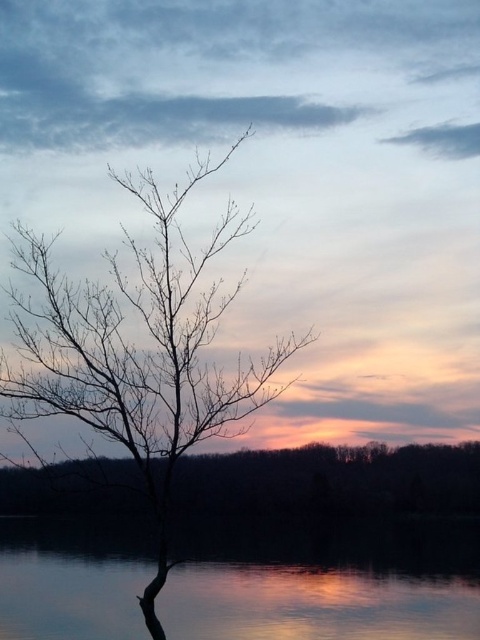
Question: Which point is farther to the camera?

Choices:
 (A) (121, 365)
 (B) (430, 593)

Answer: (B)

Question: Can you confirm if smooth water at lower center is thinner than silhouette bark tree at center?

Choices:
 (A) yes
 (B) no

Answer: (A)

Question: Is smooth water at lower center wider than silhouette bark tree at center?

Choices:
 (A) yes
 (B) no

Answer: (B)

Question: Which of the following is the farthest from the observer?

Choices:
 (A) smooth water at lower center
 (B) silhouette bark tree at center

Answer: (A)

Question: Which object is farther from the camera taking this photo?

Choices:
 (A) silhouette bark tree at center
 (B) smooth water at lower center

Answer: (B)

Question: Can you confirm if smooth water at lower center is bigger than silhouette bark tree at center?

Choices:
 (A) no
 (B) yes

Answer: (A)